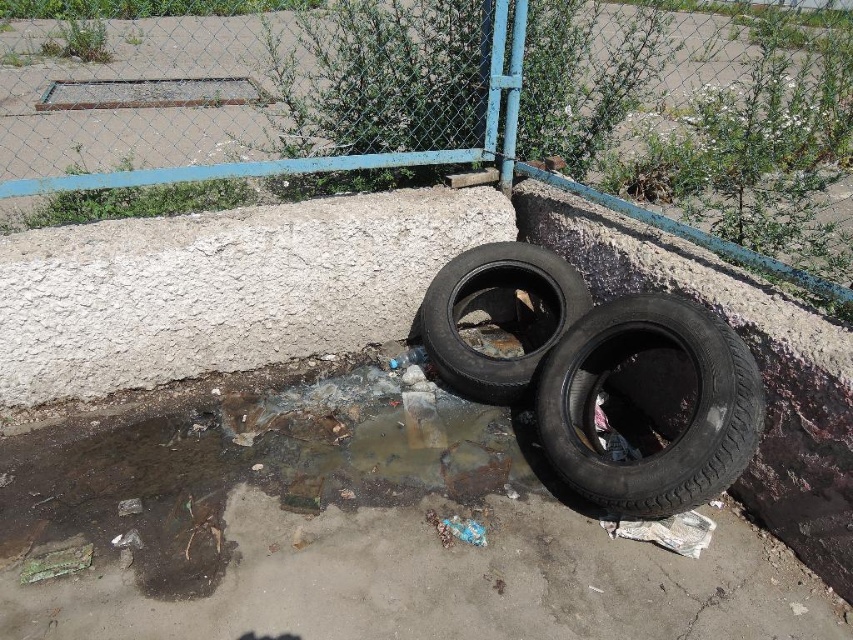
Question: Which object appears farthest from the camera in this image?

Choices:
 (A) black rubber tire at center
 (B) brown mud puddle at lower center

Answer: (A)

Question: Which point is farther to the camera?

Choices:
 (A) rusty metal fence at upper center
 (B) brown mud puddle at lower left

Answer: (A)

Question: Which point is farther to the camera?

Choices:
 (A) brown mud puddle at lower center
 (B) black rubber tire at lower right

Answer: (A)

Question: Does brown mud puddle at lower center have a smaller size compared to black rubber tire at center?

Choices:
 (A) yes
 (B) no

Answer: (B)

Question: Is brown mud puddle at lower left below brown mud puddle at lower center?

Choices:
 (A) yes
 (B) no

Answer: (A)

Question: Does black rubber tire at lower right appear on the right side of brown mud puddle at lower center?

Choices:
 (A) no
 (B) yes

Answer: (B)